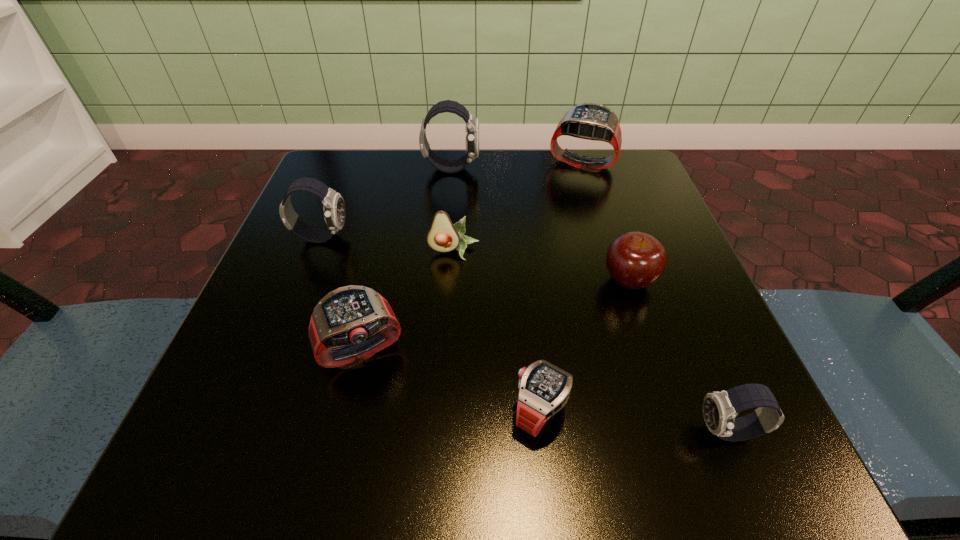
You are a GUI agent. You are given a task and a screenshot of the screen. Output one action in this format:
    pyautogui.click(x=<x>, y=<y>)
    Task: Click on the vacant space situated on the seed side of the avocado
    
    Given the screenshot: What is the action you would take?
    449,318

Identify the location of free space located on the face of the smallest dark watch. (509, 432).

Locate an element on the screen. The image size is (960, 540). free spot located 0.260m on the face of the smallest dark watch is located at coordinates (492, 432).

You are a GUI agent. You are given a task and a screenshot of the screen. Output one action in this format:
    pyautogui.click(x=<x>, y=<y>)
    Task: Click on the vacant point located 0.320m on the face of the smallest dark watch
    This screenshot has height=540, width=960.
    Given the screenshot: What is the action you would take?
    pyautogui.click(x=445, y=432)

Locate an element on the screen. free space located 0.070m on the back of the smallest red watch is located at coordinates (534, 341).

Find the location of a particular element. This screenshot has height=540, width=960. apple present at the right edge is located at coordinates 635,260.

The image size is (960, 540). What are the coordinates of `object that is at the far right corner` in the screenshot? It's located at (592, 121).

Identify the location of object that is at the near right corner. [x=719, y=408].

Where is `vacant area at the far edge`? vacant area at the far edge is located at coordinates (565, 164).

What are the coordinates of `free location at the near edge of the desktop` in the screenshot? It's located at (605, 418).